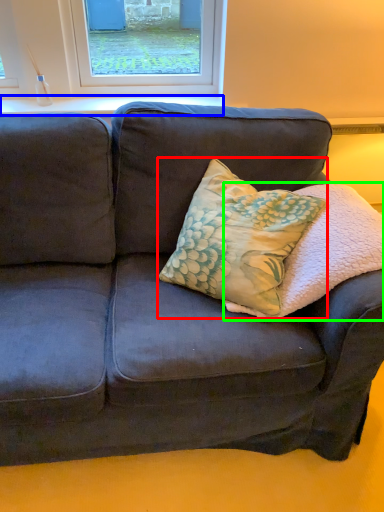
Question: Estimate the real-world distances between objects in this image. Which object is farther from throw pillow (highlighted by a red box), window sill (highlighted by a blue box) or pillow (highlighted by a green box)?

Choices:
 (A) window sill
 (B) pillow

Answer: (A)